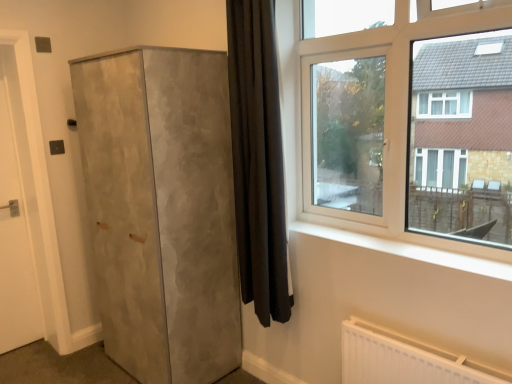
Locate an element on the screen. This screenshot has width=512, height=384. black velvet curtain at center is located at coordinates (258, 158).

Image resolution: width=512 pixels, height=384 pixels. I want to click on white matte door at left, so click(x=16, y=218).

In order to face matte concrete cupboard at left, should I rotate leftwards or rightwards?

You should rotate left by 12.371 degrees.

Describe the element at coordinates (385, 116) in the screenshot. The height and width of the screenshot is (384, 512). I see `clear glass window at upper right` at that location.

The width and height of the screenshot is (512, 384). I want to click on black velvet curtain at center, so click(258, 158).

Is clear glass window at upper right inside or outside of matte concrete cupboard at left?

clear glass window at upper right lies outside matte concrete cupboard at left.

Would you say clear glass window at upper right is a long distance from matte concrete cupboard at left?

Actually, clear glass window at upper right and matte concrete cupboard at left are a little close together.

Is clear glass window at upper right at the left side of matte concrete cupboard at left?

No, clear glass window at upper right is not to the left of matte concrete cupboard at left.

Which of these two, clear glass window at upper right or matte concrete cupboard at left, stands shorter?

clear glass window at upper right is shorter.

Consider the image. From a real-world perspective, who is located higher, matte concrete cupboard at left or white matte door at left?

From a 3D spatial view, white matte door at left is above.

Is matte concrete cupboard at left behind white matte door at left?

No, the depth of matte concrete cupboard at left is less than that of white matte door at left.

Where is `door on the left of matte concrete cupboard at left`? door on the left of matte concrete cupboard at left is located at coordinates (16, 218).

Does matte concrete cupboard at left have a greater width compared to white matte door at left?

Yes.

In the scene shown: Based on their positions, is black velvet curtain at center located to the left or right of white matte door at left?

Based on their positions, black velvet curtain at center is located to the right of white matte door at left.

Is black velvet curtain at center next to white matte door at left?

No, black velvet curtain at center is not next to white matte door at left.

From a real-world perspective, is black velvet curtain at center positioned above or below white matte door at left?

black velvet curtain at center is above white matte door at left.

Identify the location of curtain above the white matte door at left (from a real-world perspective). The image size is (512, 384). (258, 158).

From a real-world perspective, is white matte door at left on clear glass window at upper right?

Incorrect, from a real-world perspective, white matte door at left is lower than clear glass window at upper right.

From the image's perspective, is white matte door at left located beneath clear glass window at upper right?

Correct, white matte door at left appears lower than clear glass window at upper right in the image.

From the picture: Is white matte door at left shorter than clear glass window at upper right?

In fact, white matte door at left may be taller than clear glass window at upper right.

Is white matte door at left oriented away from clear glass window at upper right?

No, white matte door at left is not facing the opposite direction of clear glass window at upper right.

Is black velvet curtain at center directly adjacent to matte concrete cupboard at left?

black velvet curtain at center and matte concrete cupboard at left are not in contact.

Can you confirm if black velvet curtain at center is smaller than matte concrete cupboard at left?

Indeed, black velvet curtain at center has a smaller size compared to matte concrete cupboard at left.

Is matte concrete cupboard at left inside black velvet curtain at center?

Actually, matte concrete cupboard at left is outside black velvet curtain at center.

I want to click on curtain above the matte concrete cupboard at left (from a real-world perspective), so click(x=258, y=158).

Which is more to the right, white matte door at left or black velvet curtain at center?

Positioned to the right is black velvet curtain at center.

Which object is further away from the camera, white matte door at left or black velvet curtain at center?

Positioned behind is white matte door at left.

Is white matte door at left wider than black velvet curtain at center?

No, white matte door at left is not wider than black velvet curtain at center.

From a real-world perspective, between white matte door at left and black velvet curtain at center, who is vertically lower?

white matte door at left.

Is clear glass window at upper right taller than black velvet curtain at center?

Incorrect, the height of clear glass window at upper right is not larger of that of black velvet curtain at center.

From a real-world perspective, who is located lower, clear glass window at upper right or black velvet curtain at center?

From a 3D spatial view, black velvet curtain at center is below.

From the image's perspective, is clear glass window at upper right located above or below black velvet curtain at center?

Clearly, from the image's perspective, clear glass window at upper right is above black velvet curtain at center.

Is clear glass window at upper right smaller than black velvet curtain at center?

Incorrect, clear glass window at upper right is not smaller in size than black velvet curtain at center.

Locate an element on the screen. The image size is (512, 384). cupboard below the clear glass window at upper right (from a real-world perspective) is located at coordinates (161, 210).

Where is `door lying on the left of matte concrete cupboard at left`? door lying on the left of matte concrete cupboard at left is located at coordinates (16, 218).

When comparing their distances from clear glass window at upper right, does white matte door at left or black velvet curtain at center seem further?

white matte door at left.

Which object lies nearer to the anchor point clear glass window at upper right, matte concrete cupboard at left or black velvet curtain at center?

Among the two, black velvet curtain at center is located nearer to clear glass window at upper right.

When comparing their distances from white matte door at left, does clear glass window at upper right or matte concrete cupboard at left seem closer?

matte concrete cupboard at left lies closer to white matte door at left than the other object.

When comparing their distances from white matte door at left, does black velvet curtain at center or clear glass window at upper right seem closer?

black velvet curtain at center is positioned closer to the anchor white matte door at left.

Based on their spatial positions, is white matte door at left or clear glass window at upper right further from black velvet curtain at center?

white matte door at left lies further to black velvet curtain at center than the other object.

Looking at the image, which one is located closer to matte concrete cupboard at left, clear glass window at upper right or black velvet curtain at center?

Among the two, black velvet curtain at center is located nearer to matte concrete cupboard at left.

When comparing their distances from matte concrete cupboard at left, does black velvet curtain at center or clear glass window at upper right seem further?

clear glass window at upper right lies further to matte concrete cupboard at left than the other object.

Considering their positions, is white matte door at left positioned further to matte concrete cupboard at left than clear glass window at upper right?

Based on the image, white matte door at left appears to be further to matte concrete cupboard at left.

The width and height of the screenshot is (512, 384). In order to click on curtain between matte concrete cupboard at left and clear glass window at upper right from left to right in this screenshot , I will do `click(258, 158)`.

At what (x,y) coordinates should I click in order to perform the action: click on cupboard located between white matte door at left and clear glass window at upper right in the left-right direction. Please return your answer as a coordinate pair (x, y). This screenshot has width=512, height=384. Looking at the image, I should click on (161, 210).

Locate an element on the screen. cupboard between white matte door at left and black velvet curtain at center in the horizontal direction is located at coordinates (161, 210).

The image size is (512, 384). Identify the location of curtain between white matte door at left and clear glass window at upper right from left to right. (258, 158).